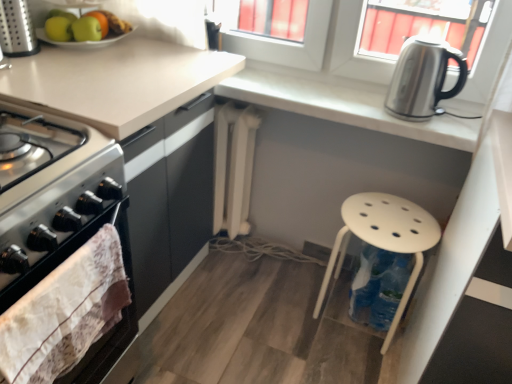
Question: Are satin silver kettle at upper right and green matte apple at upper left far apart?

Choices:
 (A) yes
 (B) no

Answer: (B)

Question: From a real-world perspective, is satin silver kettle at upper right located beneath green matte apple at upper left?

Choices:
 (A) yes
 (B) no

Answer: (A)

Question: Can you confirm if satin silver kettle at upper right is thinner than green matte apple at upper left?

Choices:
 (A) no
 (B) yes

Answer: (B)

Question: Considering the relative positions of satin silver kettle at upper right and green matte apple at upper left in the image provided, is satin silver kettle at upper right to the left of green matte apple at upper left from the viewer's perspective?

Choices:
 (A) no
 (B) yes

Answer: (A)

Question: Could you tell me if satin silver kettle at upper right is turned towards green matte apple at upper left?

Choices:
 (A) no
 (B) yes

Answer: (A)

Question: Can you confirm if satin silver kettle at upper right is smaller than green matte apple at upper left?

Choices:
 (A) no
 (B) yes

Answer: (A)

Question: Considering the relative sizes of white plastic stool at lower right and white fabric towel at left in the image provided, is white plastic stool at lower right wider than white fabric towel at left?

Choices:
 (A) yes
 (B) no

Answer: (A)

Question: From a real-world perspective, does white plastic stool at lower right stand above white fabric towel at left?

Choices:
 (A) no
 (B) yes

Answer: (A)

Question: Is the depth of white plastic stool at lower right less than that of white fabric towel at left?

Choices:
 (A) yes
 (B) no

Answer: (B)

Question: Is white plastic stool at lower right smaller than white fabric towel at left?

Choices:
 (A) yes
 (B) no

Answer: (B)

Question: Does white plastic stool at lower right turn towards white fabric towel at left?

Choices:
 (A) yes
 (B) no

Answer: (B)

Question: Is white plastic stool at lower right further to camera compared to white fabric towel at left?

Choices:
 (A) yes
 (B) no

Answer: (A)

Question: Can we say white matte radiator at center lies outside green matte apple at upper left, the second apple in the right-to-left sequence?

Choices:
 (A) yes
 (B) no

Answer: (A)